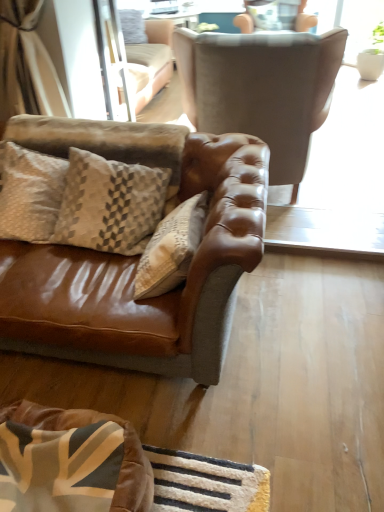
Question: Is velvet brown dog bed at lower left placed right next to suede brown armchair at upper center, marked as the second chair in a back-to-front arrangement?

Choices:
 (A) no
 (B) yes

Answer: (A)

Question: Is velvet brown dog bed at lower left thinner than suede brown armchair at upper center, the 1th chair from the bottom?

Choices:
 (A) no
 (B) yes

Answer: (B)

Question: Is velvet brown dog bed at lower left looking in the opposite direction of suede brown armchair at upper center, which appears as the second chair when viewed from the top?

Choices:
 (A) yes
 (B) no

Answer: (A)

Question: Is velvet brown dog bed at lower left at the right side of suede brown armchair at upper center, the 1th chair from the bottom?

Choices:
 (A) yes
 (B) no

Answer: (B)

Question: From the image's perspective, is velvet brown dog bed at lower left below suede brown armchair at upper center, arranged as the 1th chair when viewed from the front?

Choices:
 (A) no
 (B) yes

Answer: (B)

Question: Considering the relative sizes of velvet brown dog bed at lower left and suede brown armchair at upper center, arranged as the 1th chair when viewed from the front, in the image provided, is velvet brown dog bed at lower left smaller than suede brown armchair at upper center, arranged as the 1th chair when viewed from the front,?

Choices:
 (A) no
 (B) yes

Answer: (B)

Question: Could you tell me if clear glass screen door at upper center is facing suede brown armchair at upper center, arranged as the 1th chair when viewed from the front?

Choices:
 (A) yes
 (B) no

Answer: (A)

Question: Can you confirm if clear glass screen door at upper center is wider than suede brown armchair at upper center, which appears as the second chair when viewed from the top?

Choices:
 (A) no
 (B) yes

Answer: (A)

Question: Considering the relative sizes of clear glass screen door at upper center and suede brown armchair at upper center, arranged as the 1th chair when viewed from the front, in the image provided, is clear glass screen door at upper center thinner than suede brown armchair at upper center, arranged as the 1th chair when viewed from the front,?

Choices:
 (A) no
 (B) yes

Answer: (B)

Question: Is there a large distance between clear glass screen door at upper center and suede brown armchair at upper center, which appears as the second chair when viewed from the top?

Choices:
 (A) no
 (B) yes

Answer: (A)

Question: Is clear glass screen door at upper center at the left side of suede brown armchair at upper center, marked as the second chair in a back-to-front arrangement?

Choices:
 (A) yes
 (B) no

Answer: (A)

Question: Is clear glass screen door at upper center not inside suede brown armchair at upper center, which appears as the second chair when viewed from the top?

Choices:
 (A) yes
 (B) no

Answer: (A)

Question: Does beige textured pillow at left lie in front of suede-like beige armchair at upper center, acting as the 2th chair starting from the bottom?

Choices:
 (A) yes
 (B) no

Answer: (A)